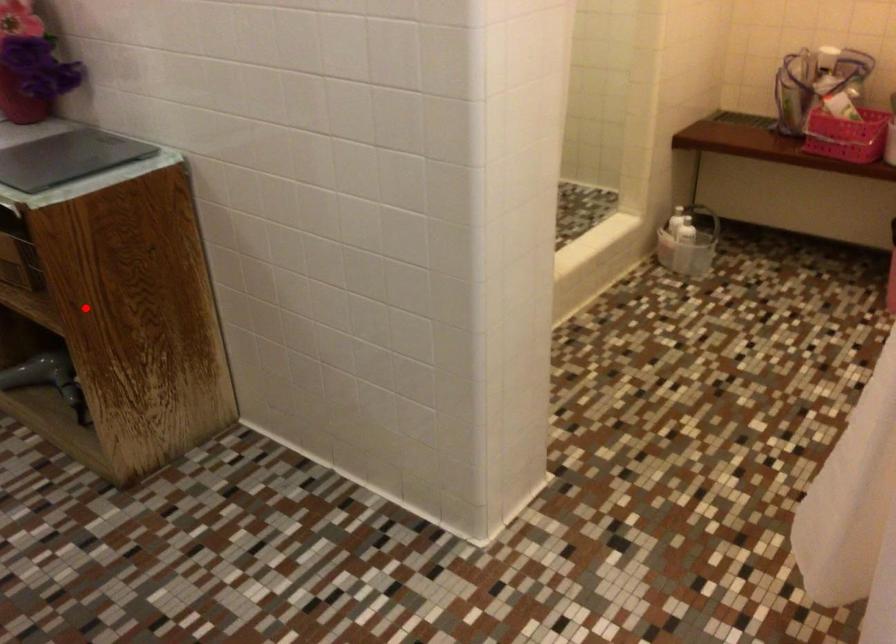
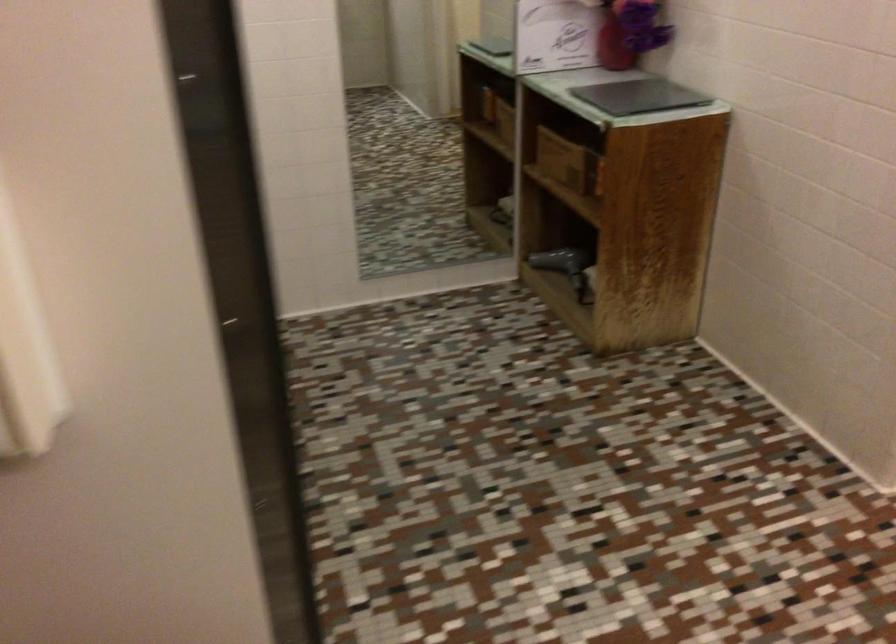
Question: I am providing you with two images of the same scene from different viewpoints. Given a red point in image1, look at the same physical point in image2. Is it:

Choices:
 (A) Closer to the viewpoint
 (B) Farther from the viewpoint

Answer: (B)